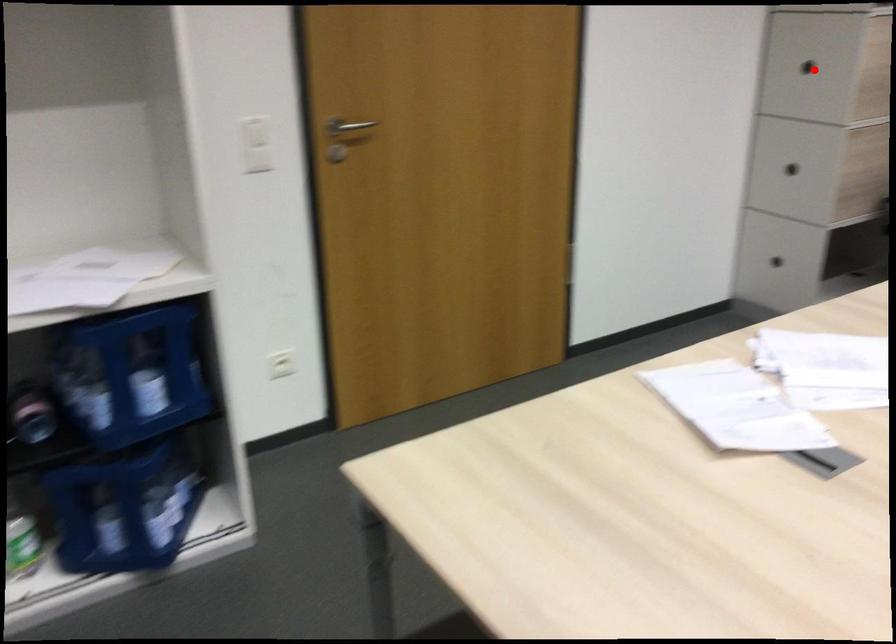
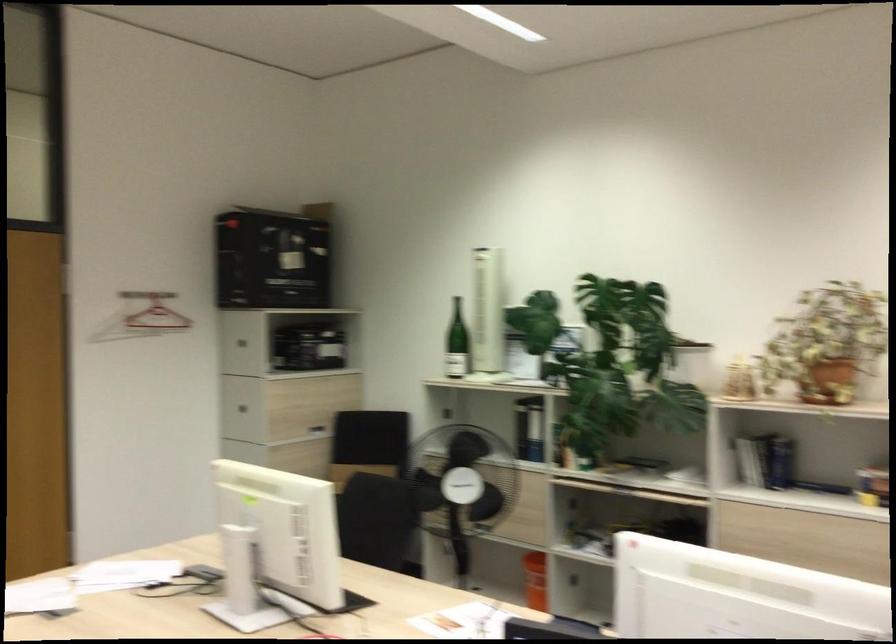
Question: I am providing you with two images of the same scene from different viewpoints. Given a red point in image1, look at the same physical point in image2. Is it:

Choices:
 (A) Closer to the viewpoint
 (B) Farther from the viewpoint

Answer: (B)